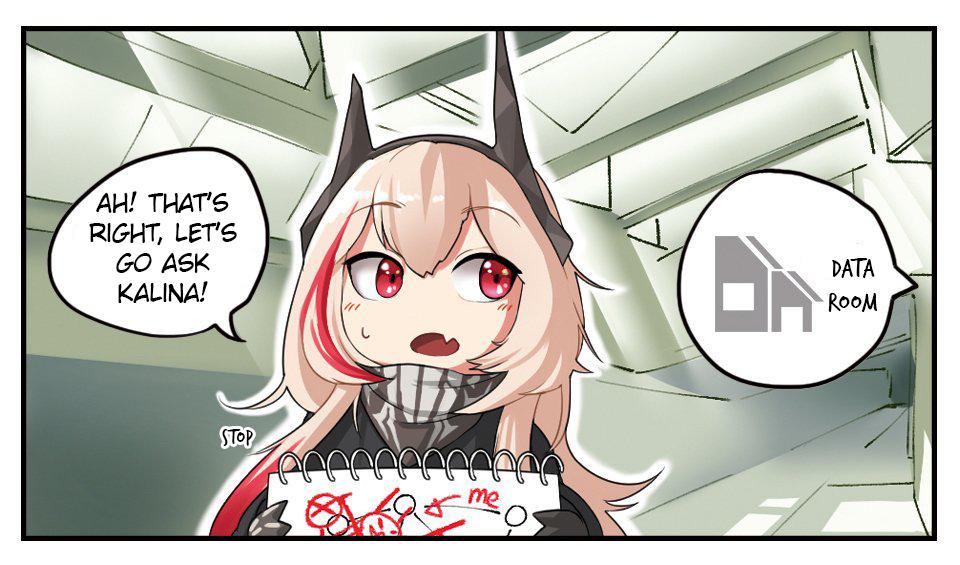
This screenshot has width=960, height=565. Find the location of `wall`. wall is located at coordinates (55, 386), (635, 389).